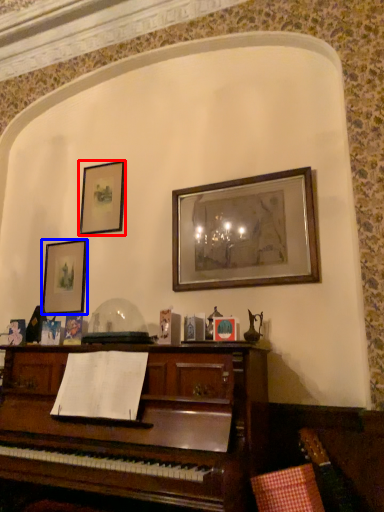
Question: Which object is closer to the camera taking this photo, picture frame (highlighted by a red box) or picture frame (highlighted by a blue box)?

Choices:
 (A) picture frame
 (B) picture frame

Answer: (B)